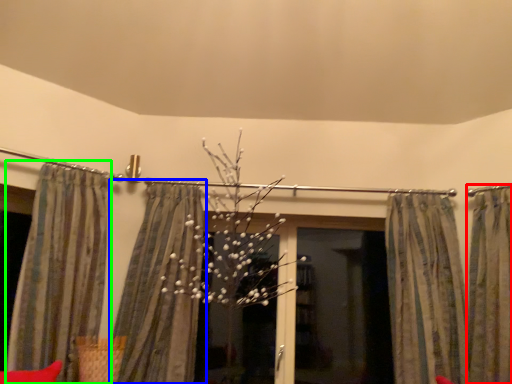
Question: Based on their relative distances, which object is nearer to curtain (highlighted by a red box)? Choose from curtain (highlighted by a blue box) and curtain (highlighted by a green box).

Choices:
 (A) curtain
 (B) curtain

Answer: (A)